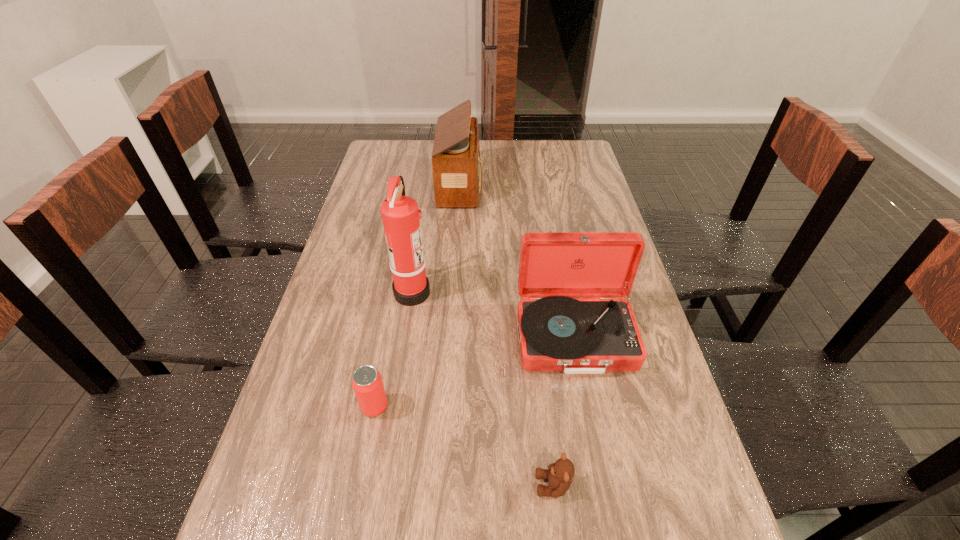
Locate an element on the screen. The height and width of the screenshot is (540, 960). empty space between the tallest object and the phonograph_record is located at coordinates (493, 314).

This screenshot has height=540, width=960. I want to click on free point between the fire extinguisher and the fourth tallest object, so click(x=394, y=349).

Where is `free area in between the second shortest object and the nearest object`? The height and width of the screenshot is (540, 960). free area in between the second shortest object and the nearest object is located at coordinates (464, 446).

Where is `free point between the fire extinguisher and the radio receiver`? The image size is (960, 540). free point between the fire extinguisher and the radio receiver is located at coordinates pyautogui.click(x=437, y=238).

Identify the location of free space between the fire extinguisher and the nearest object. (483, 388).

The image size is (960, 540). I want to click on vacant space in between the shortest object and the radio receiver, so click(x=507, y=335).

You are a GUI agent. You are given a task and a screenshot of the screen. Output one action in this format:
    pyautogui.click(x=<x>, y=<y>)
    Task: Click on the vacant area between the shortest object and the radio receiver
    Image resolution: width=960 pixels, height=540 pixels.
    Given the screenshot: What is the action you would take?
    pyautogui.click(x=507, y=335)

At what (x,y) coordinates should I click in order to perform the action: click on empty location between the fire extinguisher and the radio receiver. Please return your answer as a coordinate pair (x, y). This screenshot has width=960, height=540. Looking at the image, I should click on (437, 238).

This screenshot has height=540, width=960. In order to click on free space between the fourth tallest object and the fire extinguisher in this screenshot , I will do `click(394, 349)`.

Find the location of a particular element. The height and width of the screenshot is (540, 960). the closest object to the teddy bear is located at coordinates (573, 319).